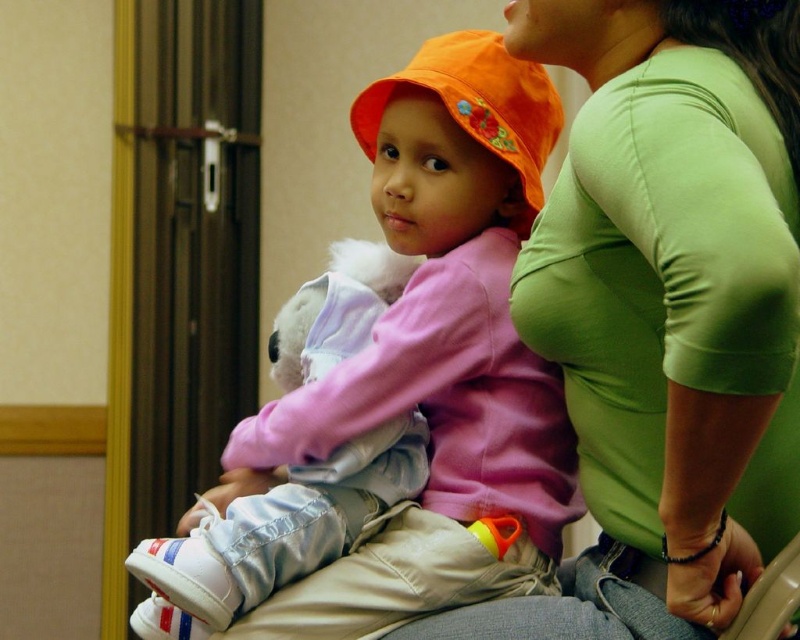
Identify the location of green matte shirt at upper right. This screenshot has width=800, height=640. (666, 308).

Image resolution: width=800 pixels, height=640 pixels. I want to click on green matte shirt at upper right, so click(666, 308).

Is green matte shirt at upper right further to the viewer compared to orange fabric hat at center?

No, green matte shirt at upper right is in front of orange fabric hat at center.

Can you confirm if green matte shirt at upper right is positioned to the right of orange fabric hat at center?

Yes, green matte shirt at upper right is to the right of orange fabric hat at center.

Is point (701, 177) positioned behind point (384, 100)?

No, (701, 177) is in front of (384, 100).

The height and width of the screenshot is (640, 800). What are the coordinates of `green matte shirt at upper right` in the screenshot? It's located at (666, 308).

From the picture: Which of these two, matte pink sweater at center or orange fabric hat at center, stands shorter?

With less height is orange fabric hat at center.

Consider the image. Does matte pink sweater at center have a lesser width compared to orange fabric hat at center?

No.

At what (x,y) coordinates should I click in order to perform the action: click on matte pink sweater at center. Please return your answer as a coordinate pair (x, y). Looking at the image, I should click on (402, 388).